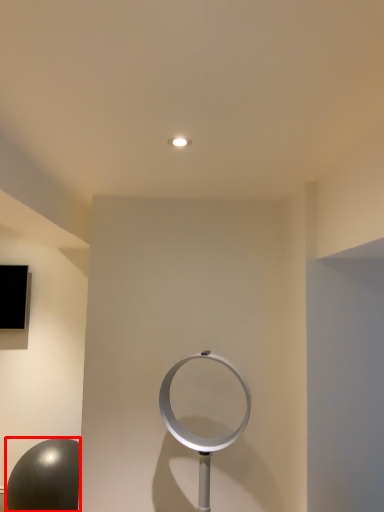
Question: From the image's perspective, what is the correct spatial relationship of ball (annotated by the red box) in relation to circle?

Choices:
 (A) above
 (B) below

Answer: (B)